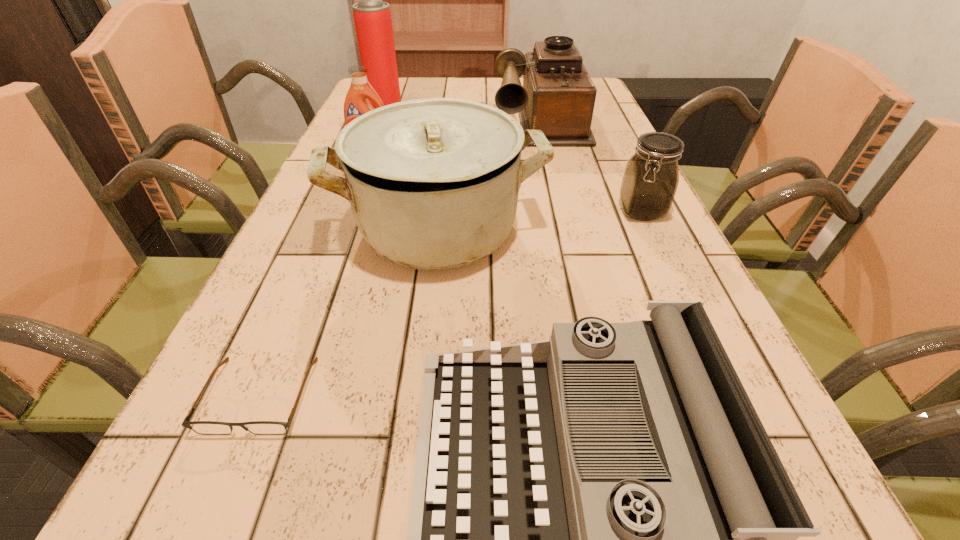
You are a GUI agent. You are given a task and a screenshot of the screen. Output one action in this format:
    pyautogui.click(x=<x>, y=<y>)
    Task: Click on the object located at the far left corner
    Image resolution: width=960 pixels, height=540 pixels.
    Given the screenshot: What is the action you would take?
    [x=372, y=17]

Where is `object that is positioned at the far right corner`? The height and width of the screenshot is (540, 960). object that is positioned at the far right corner is located at coordinates (558, 96).

The height and width of the screenshot is (540, 960). Find the location of `vacant space at the far edge of the desktop`. vacant space at the far edge of the desktop is located at coordinates (444, 83).

You are a GUI agent. You are given a task and a screenshot of the screen. Output one action in this format:
    pyautogui.click(x=<x>, y=<y>)
    Task: Click on the free space at the left edge
    This screenshot has height=540, width=960.
    Given the screenshot: What is the action you would take?
    pyautogui.click(x=262, y=338)

The height and width of the screenshot is (540, 960). Identify the location of vacant space at the right edge of the desktop. (617, 174).

At what (x,y) coordinates should I click in order to perform the action: click on blank region between the saucepan and the shortest object. Please return your answer as a coordinate pair (x, y). This screenshot has height=540, width=960. Looking at the image, I should click on (348, 312).

Identify the location of vacant area that lies between the jar and the spectacles. The image size is (960, 540). (450, 303).

At what (x,y) coordinates should I click in order to perform the action: click on free space between the jar and the phonograph_record. Please return your answer as a coordinate pair (x, y). The width and height of the screenshot is (960, 540). Looking at the image, I should click on (590, 165).

The height and width of the screenshot is (540, 960). Identify the location of free space between the spectacles and the detergent. (316, 273).

At what (x,y) coordinates should I click in order to perform the action: click on object that is the third closest to the shortest object. Please return your answer as a coordinate pair (x, y). Looking at the image, I should click on (649, 184).